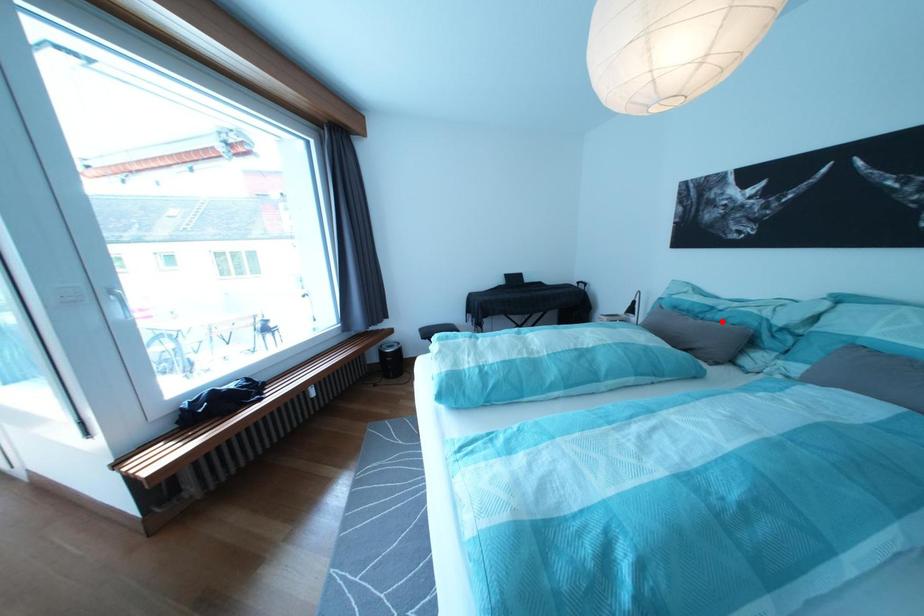
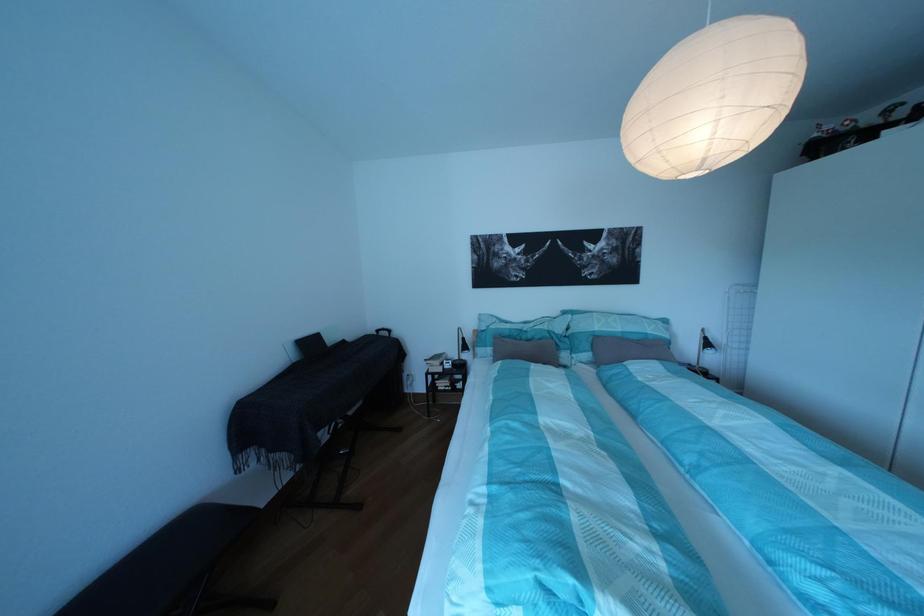
Find the pixel in the second image that matches the highlighted location in the first image.

(538, 342)